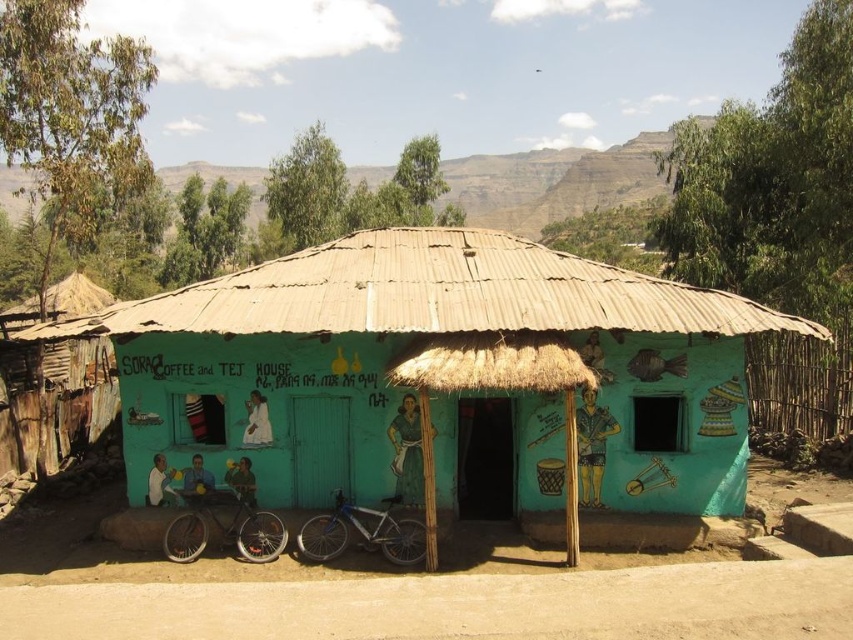
Question: Which of the following is the farthest from the observer?

Choices:
 (A) brown thatch roof at center
 (B) brown sandy dirt at lower center
 (C) teal painted hut at center

Answer: (A)

Question: Which object is closer to the camera taking this photo?

Choices:
 (A) brown thatch roof at center
 (B) teal painted hut at center

Answer: (B)

Question: Is the position of teal painted hut at center more distant than that of shiny metallic bicycle at lower left?

Choices:
 (A) no
 (B) yes

Answer: (A)

Question: Where is teal painted hut at center located in relation to brown sandy dirt at lower center in the image?

Choices:
 (A) left
 (B) right

Answer: (A)

Question: Does teal painted hut at center have a larger size compared to silver metallic bicycle at center?

Choices:
 (A) yes
 (B) no

Answer: (A)

Question: Which is nearer to the brown thatch roof at center?

Choices:
 (A) silver metallic bicycle at center
 (B) brown sandy dirt at lower center

Answer: (A)